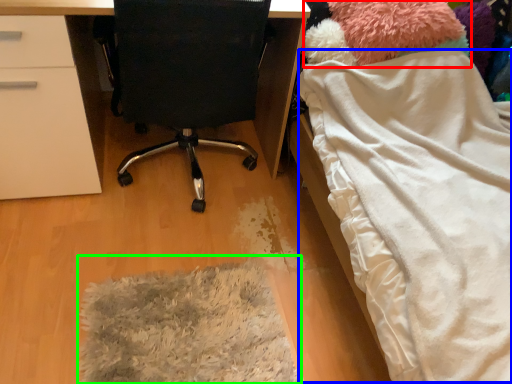
Question: Based on their relative distances, which object is nearer to teddy (highlighted by a red box)? Choose from blanket (highlighted by a blue box) and mat (highlighted by a green box).

Choices:
 (A) blanket
 (B) mat

Answer: (A)